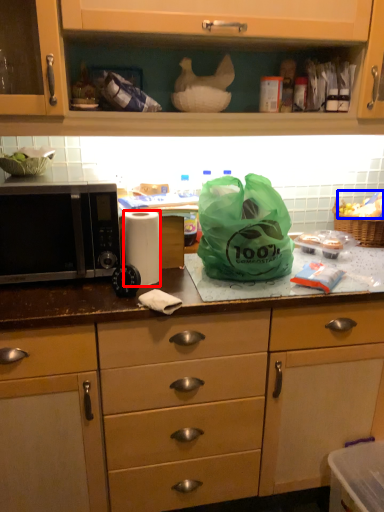
Question: Which object appears farthest to the camera in this image, paper towel (highlighted by a red box) or food (highlighted by a blue box)?

Choices:
 (A) paper towel
 (B) food

Answer: (B)